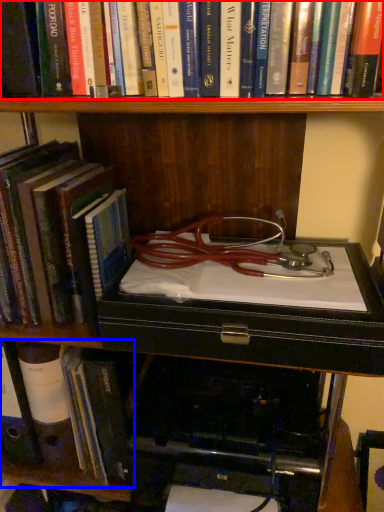
Question: Which point is further to the camera, book (highlighted by a red box) or book (highlighted by a blue box)?

Choices:
 (A) book
 (B) book

Answer: (B)